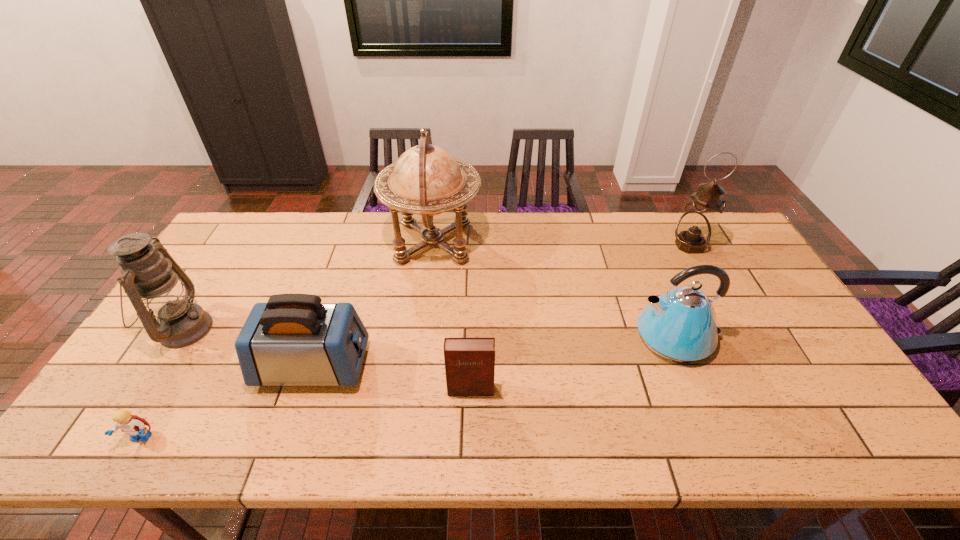
The width and height of the screenshot is (960, 540). What are the coordinates of `vacant space located 0.400m on the right of the left oil lamp` in the screenshot? It's located at (354, 329).

The height and width of the screenshot is (540, 960). I want to click on free space located at the spout of the kettle, so click(612, 337).

Where is `free space located at the spout of the kettle`? The image size is (960, 540). free space located at the spout of the kettle is located at coordinates (565, 337).

What are the coordinates of `blank space located at the spout of the kettle` in the screenshot? It's located at (555, 337).

Locate an element on the screen. The height and width of the screenshot is (540, 960). vacant space located 0.250m on the front-facing side of the toaster is located at coordinates (464, 366).

Find the location of a particular element. vacant space positioned on the front cover of the sixth tallest object is located at coordinates (469, 435).

I want to click on globe that is at the far edge, so click(427, 180).

The height and width of the screenshot is (540, 960). I want to click on oil lamp at the far edge, so click(x=694, y=230).

The image size is (960, 540). In order to click on object at the near edge in this screenshot , I will do `click(132, 425)`.

I want to click on oil lamp located at the left edge, so [155, 284].